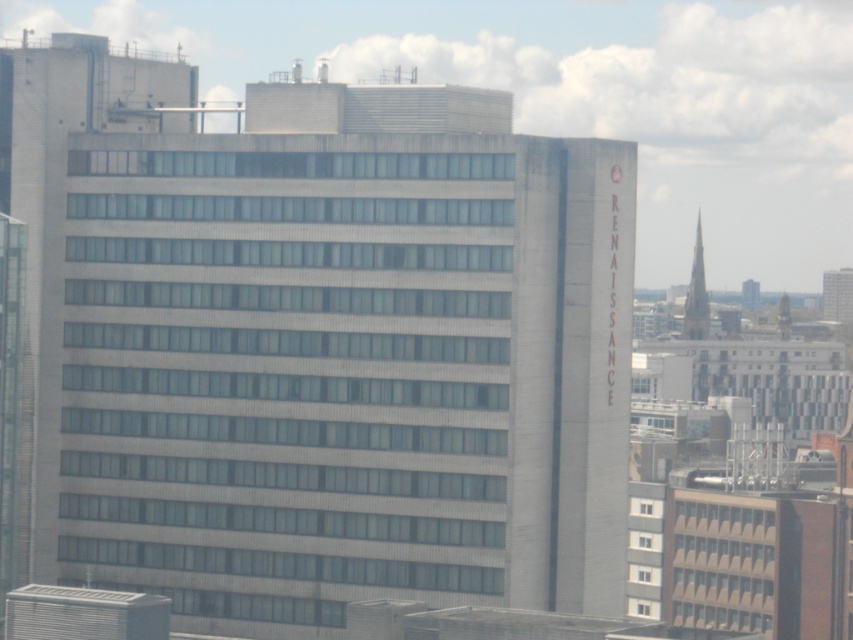
You are an architect evaluating the building design. Which object in the scene takes up more visual space, the white concrete building at center or the smooth gray steeple at upper right?

The white concrete building at center takes up more visual space than the smooth gray steeple at upper right because it is bigger.

You are standing at a park across the street from the white concrete building at center. The park has a walking path that is 300 feet long. If you walk straight towards the building along the path, will you reach it before the path ends?

The distance of white concrete building at center from viewer is 1222.19 feet, which is longer than the 300 feet walking path. Therefore, you will not reach the building before the path ends.

You are standing in front of the Renaissance building and want to take a photo that includes both the white concrete building at center and the smooth gray steeple at upper right. Which object will appear larger in the photo?

The white concrete building at center will appear larger in the photo because it is taller than the smooth gray steeple at upper right.